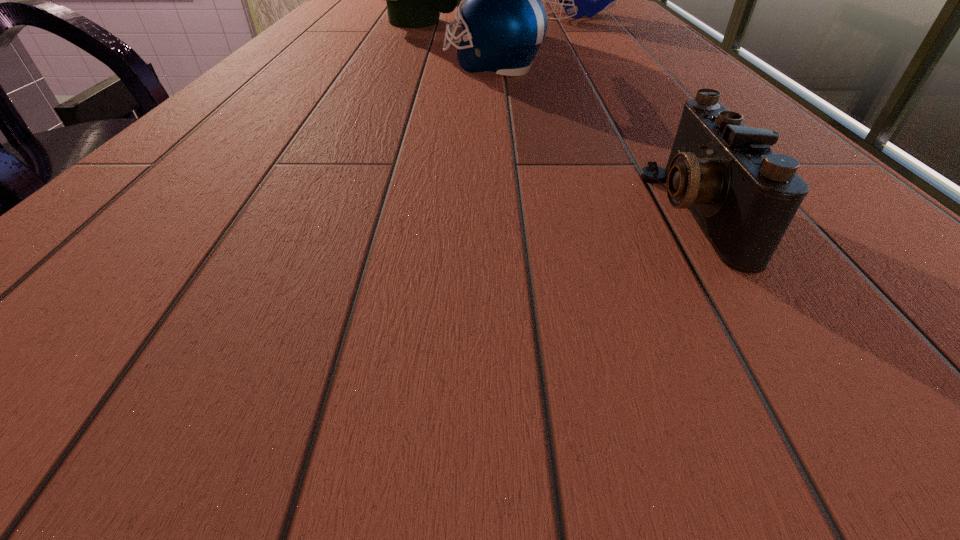
Where is `object located at the far left corner`? object located at the far left corner is located at coordinates (414, 0).

You are a GUI agent. You are given a task and a screenshot of the screen. Output one action in this format:
    pyautogui.click(x=<x>, y=<y>)
    Task: Click on the object that is at the far right corner
    This screenshot has width=960, height=540.
    Given the screenshot: What is the action you would take?
    pyautogui.click(x=578, y=0)

In the image, there is a desktop. Identify the location of vacant region at the left edge. The width and height of the screenshot is (960, 540). (353, 33).

The width and height of the screenshot is (960, 540). What are the coordinates of `free space at the right edge of the desktop` in the screenshot? It's located at (845, 312).

Where is `free space at the near right corner of the desktop`? free space at the near right corner of the desktop is located at coordinates pos(924,347).

At what (x,y) coordinates should I click in order to perform the action: click on free point between the second tallest object and the camera. Please return your answer as a coordinate pair (x, y). The width and height of the screenshot is (960, 540). Looking at the image, I should click on (636, 114).

This screenshot has width=960, height=540. I want to click on vacant space that's between the camera and the tallest football helmet, so click(559, 117).

This screenshot has width=960, height=540. Find the location of `vacant space that's between the nearest football helmet and the camera`. vacant space that's between the nearest football helmet and the camera is located at coordinates (593, 139).

Find the location of `vacant space in between the second tallest object and the camera`. vacant space in between the second tallest object and the camera is located at coordinates (636, 114).

Where is `unoccupied position between the shortest object and the third tallest object`? Image resolution: width=960 pixels, height=540 pixels. unoccupied position between the shortest object and the third tallest object is located at coordinates (593, 139).